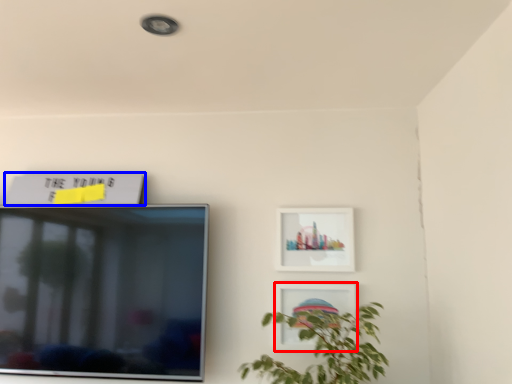
Question: Among these objects, which one is nearest to the camera, picture frame (highlighted by a red box) or picture frame (highlighted by a blue box)?

Choices:
 (A) picture frame
 (B) picture frame

Answer: (A)